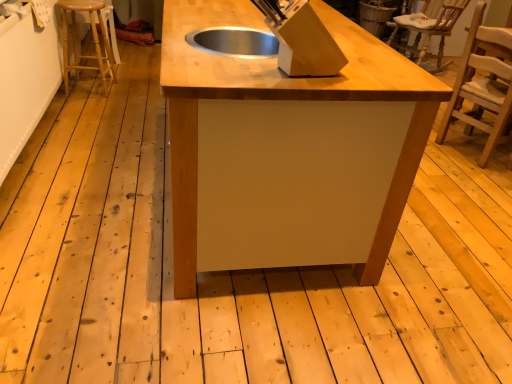
Question: From a real-world perspective, is wooden chair at upper right, which is the 1th chair in top-to-bottom order, under matte wood table at center?

Choices:
 (A) yes
 (B) no

Answer: (A)

Question: Considering the relative sizes of wooden chair at upper right, the 2th chair when ordered from bottom to top, and matte wood table at center in the image provided, is wooden chair at upper right, the 2th chair when ordered from bottom to top, taller than matte wood table at center?

Choices:
 (A) no
 (B) yes

Answer: (A)

Question: Is wooden chair at upper right, which is the 2th chair from front to back, oriented away from matte wood table at center?

Choices:
 (A) no
 (B) yes

Answer: (A)

Question: Are wooden chair at upper right, which is the 1th chair in top-to-bottom order, and matte wood table at center far apart?

Choices:
 (A) yes
 (B) no

Answer: (A)

Question: Does wooden chair at upper right, which is counted as the first chair, starting from the back, appear on the right side of matte wood table at center?

Choices:
 (A) no
 (B) yes

Answer: (B)

Question: Considering the positions of light brown wooden stool at left and matte wood table at center in the image, is light brown wooden stool at left wider or thinner than matte wood table at center?

Choices:
 (A) thin
 (B) wide

Answer: (A)

Question: Looking at the image, does light brown wooden stool at left seem bigger or smaller compared to matte wood table at center?

Choices:
 (A) small
 (B) big

Answer: (A)

Question: From the image's perspective, is light brown wooden stool at left located above or below matte wood table at center?

Choices:
 (A) below
 (B) above

Answer: (B)

Question: Is light brown wooden stool at left situated inside matte wood table at center or outside?

Choices:
 (A) inside
 (B) outside

Answer: (B)

Question: Relative to wooden chair at upper right, which is the 1th chair in top-to-bottom order, is light brown wooden chair at right, marked as the 2th chair in a back-to-front arrangement, in front or behind?

Choices:
 (A) behind
 (B) front

Answer: (B)

Question: Is light brown wooden chair at right, which ranks as the first chair in front-to-back order, bigger or smaller than wooden chair at upper right, which is counted as the first chair, starting from the back?

Choices:
 (A) big
 (B) small

Answer: (B)

Question: Is light brown wooden chair at right, placed as the first chair when sorted from bottom to top, wider or thinner than wooden chair at upper right, which is counted as the first chair, starting from the back?

Choices:
 (A) thin
 (B) wide

Answer: (A)

Question: Considering the relative positions of light brown wooden chair at right, placed as the first chair when sorted from bottom to top, and wooden chair at upper right, which is the 2th chair from front to back, in the image provided, is light brown wooden chair at right, placed as the first chair when sorted from bottom to top, to the left or to the right of wooden chair at upper right, which is the 2th chair from front to back,?

Choices:
 (A) right
 (B) left

Answer: (B)

Question: Would you say light brown wooden stool at left is to the left or to the right of light brown wooden chair at right, placed as the first chair when sorted from bottom to top, in the picture?

Choices:
 (A) left
 (B) right

Answer: (A)

Question: In terms of height, does light brown wooden stool at left look taller or shorter compared to light brown wooden chair at right, placed as the first chair when sorted from bottom to top?

Choices:
 (A) short
 (B) tall

Answer: (A)